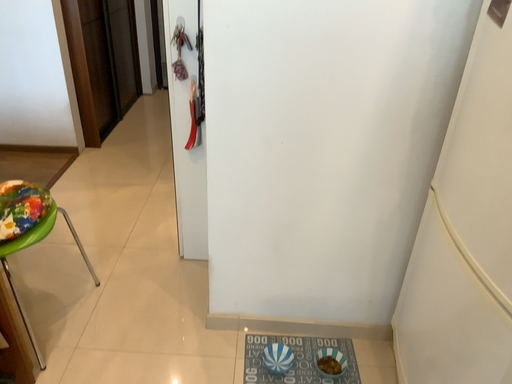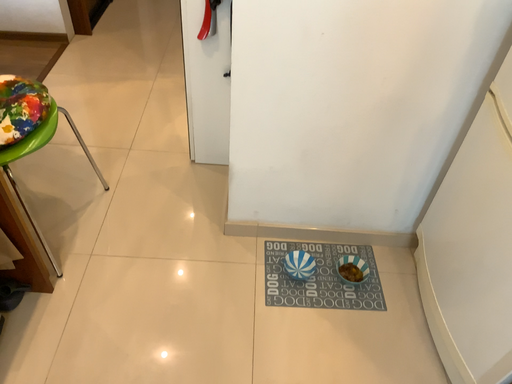
Question: How did the camera likely rotate when shooting the video?

Choices:
 (A) rotated downward
 (B) rotated upward

Answer: (A)